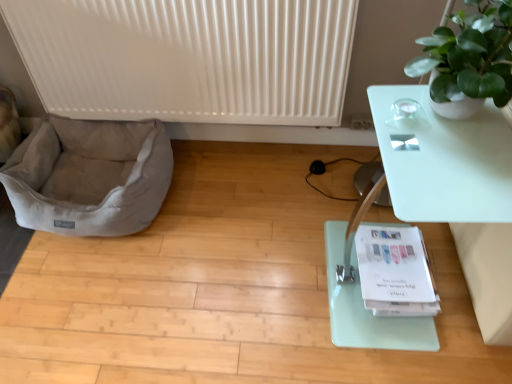
At what (x,y) coordinates should I click in order to perform the action: click on free space above transparent glass table at right (from a real-world perspective). Please return your answer as a coordinate pair (x, y). This screenshot has width=512, height=384. Looking at the image, I should click on (444, 145).